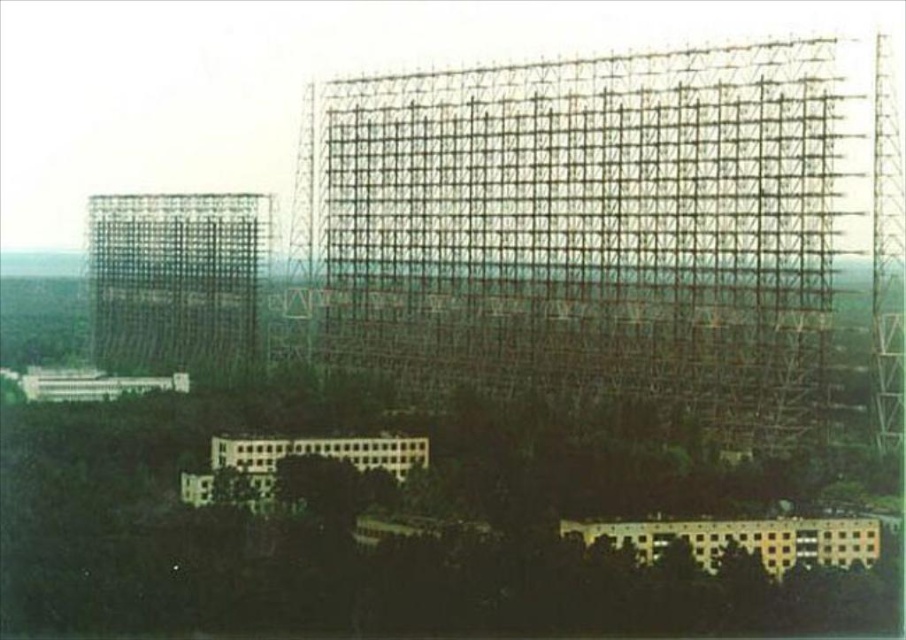
You are a drone operator tasked with capturing aerial footage of the Duga radar system in the Chernobyl Exclusion Zone. Your mission requires you to fly your drone to a specific point marked by coordinates. The point is labeled as point (x=585, y=228). Once you reach this point, you must determine what the drone is directly above. What object is located at this coordinate point?

The point (x=585, y=228) marks the metallic grid structure at center, so the drone is directly above the metallic grid structure at center.

You are standing at the entrance of the radar installation and want to reach the point marked as point (350, 154) and point (162, 316). Which point should you head towards first if you want to reach the one closer to you?

You should head towards point (350, 154) first because it is closer to you than point (162, 316).

You are a photographer planning to capture the entire radar installation from a specific viewpoint. You notice the metallic grid structure at center and the metallic grid structure at left. Which structure will appear closer to you in the photo?

The metallic grid structure at center will appear closer to you in the photo because it is positioned in front of the metallic grid structure at left.